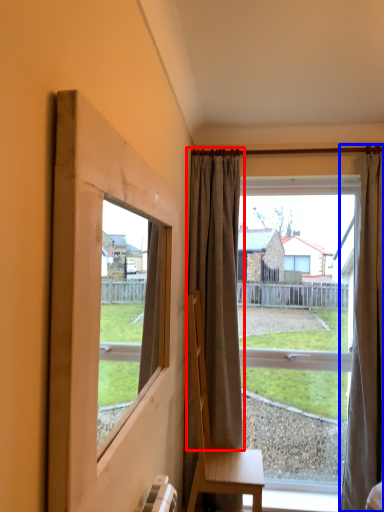
Question: Which of the following is the farthest to the observer, curtain (highlighted by a red box) or curtain (highlighted by a blue box)?

Choices:
 (A) curtain
 (B) curtain

Answer: (A)